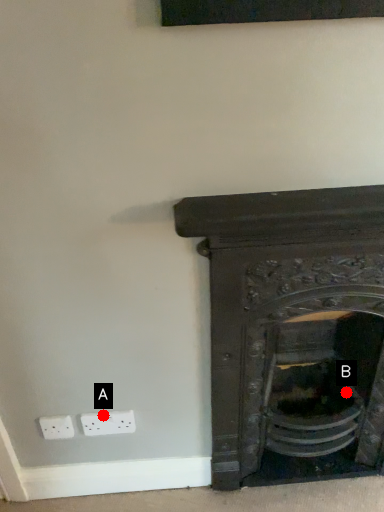
Question: Two points are circled on the image, labeled by A and B beside each circle. Which point is closer to the camera?

Choices:
 (A) A is closer
 (B) B is closer

Answer: (A)